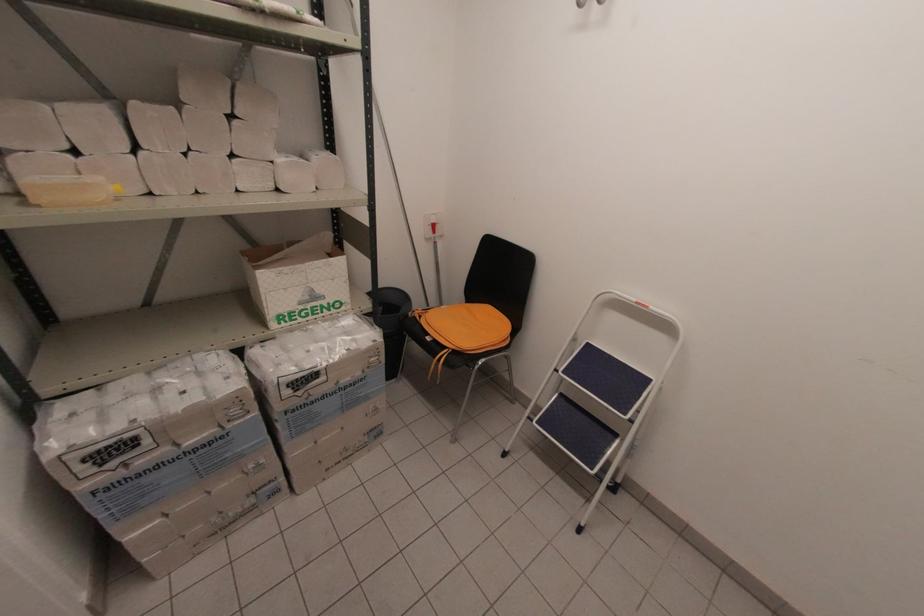
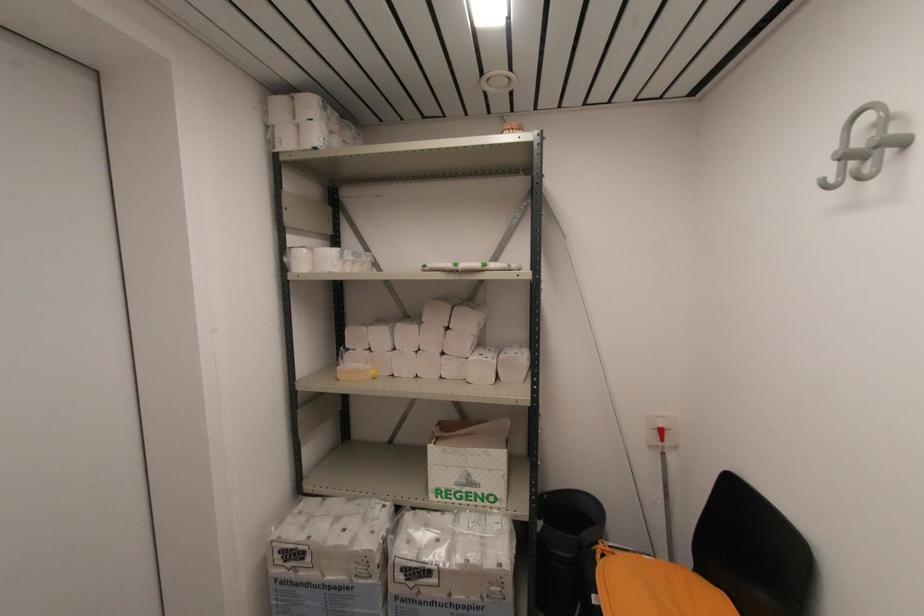
The point at (40,207) is marked in the first image. Where is the corresponding point in the second image?

(339, 381)